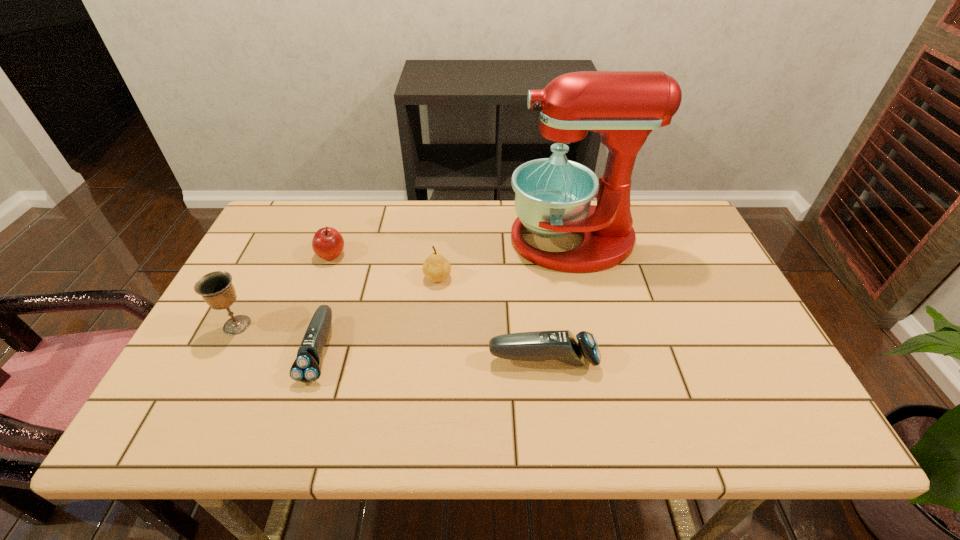
Locate an element on the screen. Image resolution: width=960 pixels, height=540 pixels. vacant area that lies between the taller electric shaver and the left electric shaver is located at coordinates (431, 355).

The image size is (960, 540). I want to click on free point between the second tallest object and the pear, so click(x=337, y=301).

The width and height of the screenshot is (960, 540). In order to click on vacant space that's between the shortest object and the right electric shaver in this screenshot , I will do `click(431, 355)`.

Where is `object that is the fourth closest to the taller electric shaver`? The width and height of the screenshot is (960, 540). object that is the fourth closest to the taller electric shaver is located at coordinates (328, 243).

The image size is (960, 540). I want to click on object identified as the closest to the right electric shaver, so click(436, 267).

The image size is (960, 540). In order to click on free location that satisfies the following two spatial constraints: 1. on the front-facing side of the tallest object; 2. on the front side of the apple in this screenshot , I will do `click(576, 254)`.

The height and width of the screenshot is (540, 960). In order to click on vacant area that satisfies the following two spatial constraints: 1. on the front-facing side of the tallest object; 2. on the head of the shorter electric shaver in this screenshot , I will do `click(598, 350)`.